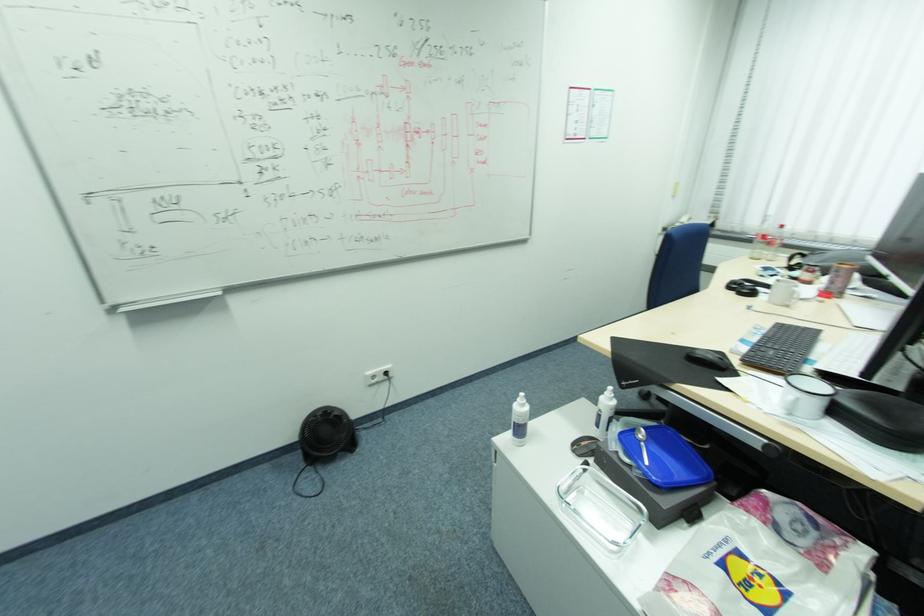
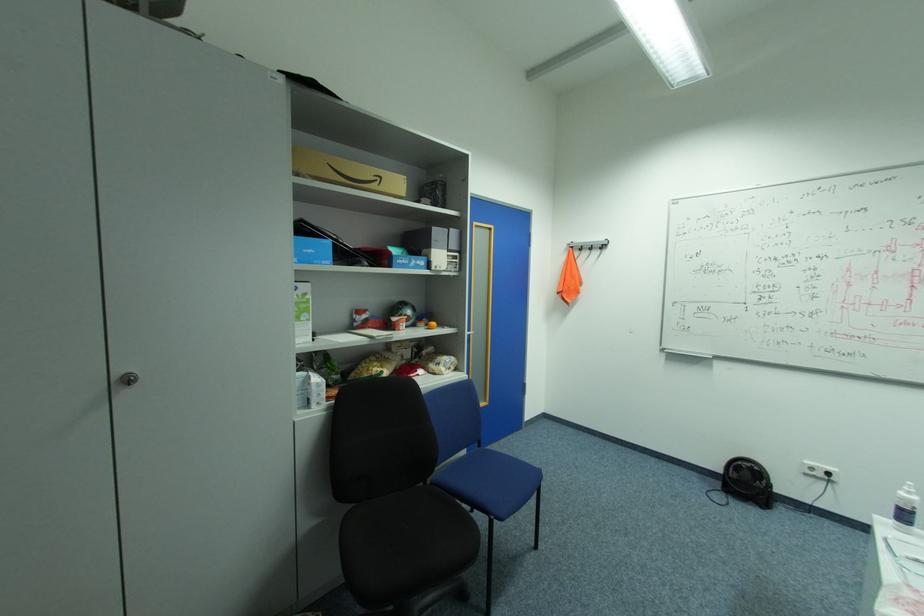
Where in the second image is the point corresponding to (304,456) from the first image?

(724, 484)